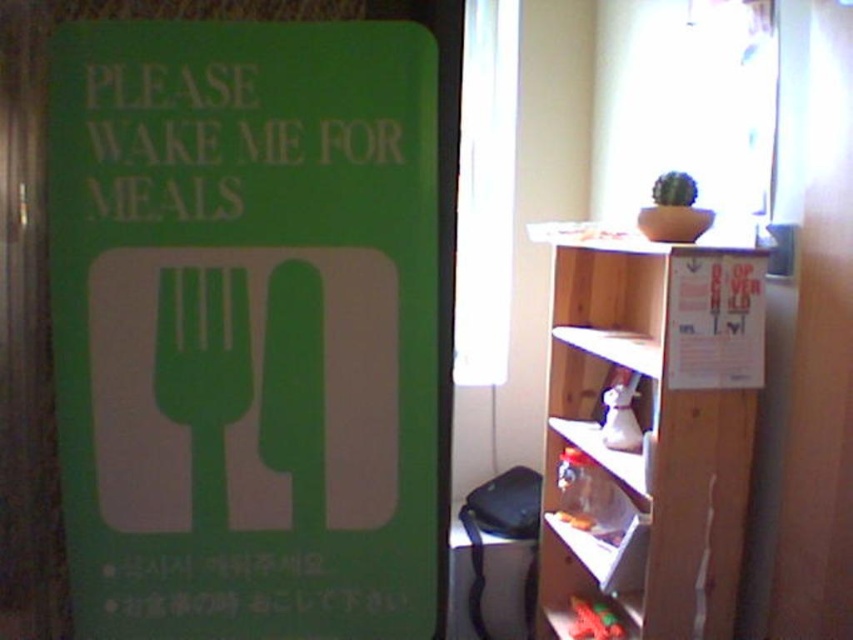
Is the position of green matte sign at left less distant than that of green matte sign at upper left?

Yes, green matte sign at left is in front of green matte sign at upper left.

Between point (315, 529) and point (196, 188), which one is positioned in front?

Positioned in front is point (196, 188).

Where is `green matte sign at left`? Image resolution: width=853 pixels, height=640 pixels. green matte sign at left is located at coordinates (247, 326).

Is green matte sign at upper left closer to the viewer compared to green matte fork at left?

That is True.

Is green matte sign at upper left taller than green matte fork at left?

Incorrect, green matte sign at upper left's height is not larger of green matte fork at left's.

Between point (83, 120) and point (219, 525), which one is positioned behind?

The point (219, 525) is behind.

This screenshot has width=853, height=640. Identify the location of green matte sign at upper left. (223, 134).

Who is positioned more to the right, green matte sign at left or green matte fork at left?

green matte sign at left is more to the right.

Does point (370, 36) come farther from viewer compared to point (238, 419)?

No, it is in front of (238, 419).

Where is `green matte sign at left`? Image resolution: width=853 pixels, height=640 pixels. green matte sign at left is located at coordinates (247, 326).